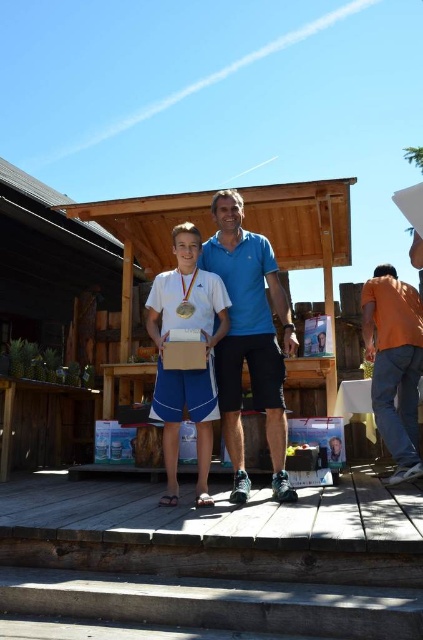
Question: Does blue fabric shirt at center have a smaller size compared to orange cotton shirt at right?

Choices:
 (A) no
 (B) yes

Answer: (B)

Question: Among these objects, which one is nearest to the camera?

Choices:
 (A) gold metallic medal at center
 (B) orange cotton shirt at right

Answer: (A)

Question: Is blue fabric shirt at center to the right of orange cotton shirt at right from the viewer's perspective?

Choices:
 (A) yes
 (B) no

Answer: (B)

Question: Which object is closer to the camera taking this photo?

Choices:
 (A) gold metallic medal at center
 (B) white matte tennis racket at center
 (C) blue fabric shirt at center
 (D) orange cotton shirt at right

Answer: (B)

Question: Among these objects, which one is nearest to the camera?

Choices:
 (A) gold metallic medal at center
 (B) blue fabric shirt at center
 (C) white matte tennis racket at center
 (D) orange cotton shirt at right

Answer: (C)

Question: Can you confirm if blue fabric shirt at center is smaller than orange cotton shirt at right?

Choices:
 (A) yes
 (B) no

Answer: (A)